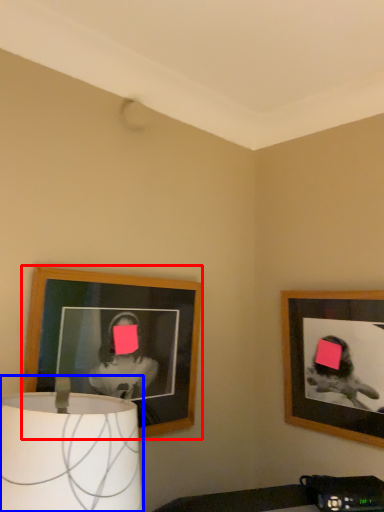
Question: Which of the following is the farthest to the observer, picture frame (highlighted by a red box) or lamp (highlighted by a blue box)?

Choices:
 (A) picture frame
 (B) lamp

Answer: (A)